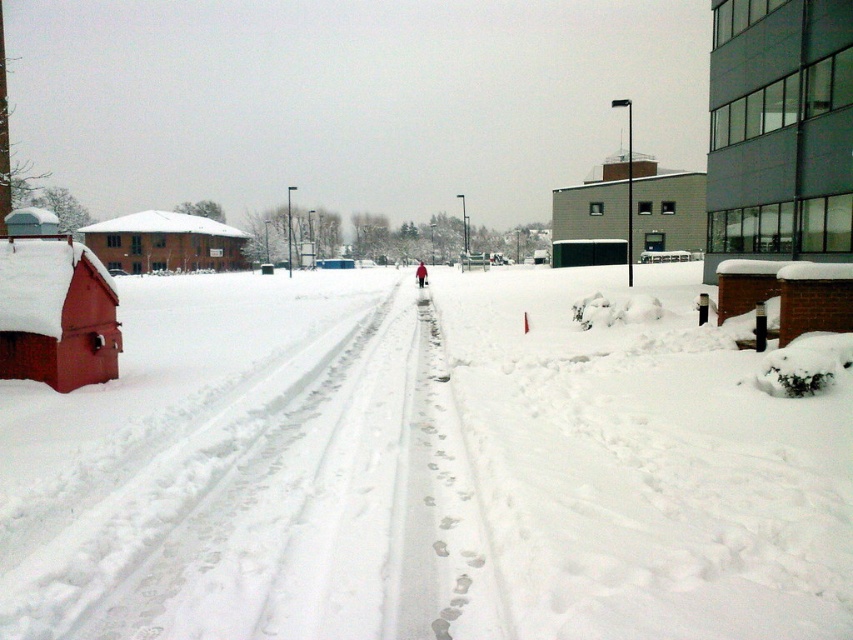
Looking at this image, you are standing at the center of the snowy scene and want to place a small snowman using the white fluffy snow at lower left. Is there enough snow available at that location to build a snowman?

The white fluffy snow at lower left is located at point (422, 468), but the description does not provide information about the quantity or depth of the snow there. Therefore, it is uncertain if there is enough snow to build a snowman.

You are a delivery robot with a 30 feet maximum delivery range. You are currently at the white fluffy snow at lower left and need to deliver a package to the dark gray glass building at right. Can you complete the delivery without exceeding your range?

The distance between the white fluffy snow at lower left and the dark gray glass building at right is 27.96 feet, which is within the robot s 30 feet maximum range. Therefore, the delivery can be completed without exceeding the range.

You are standing at the center of the snowy urban scene. There is a point marked at coordinates (422,468). What object or feature in the scene corresponds to this point?

The point at coordinates (422,468) corresponds to the white fluffy snow at lower left.